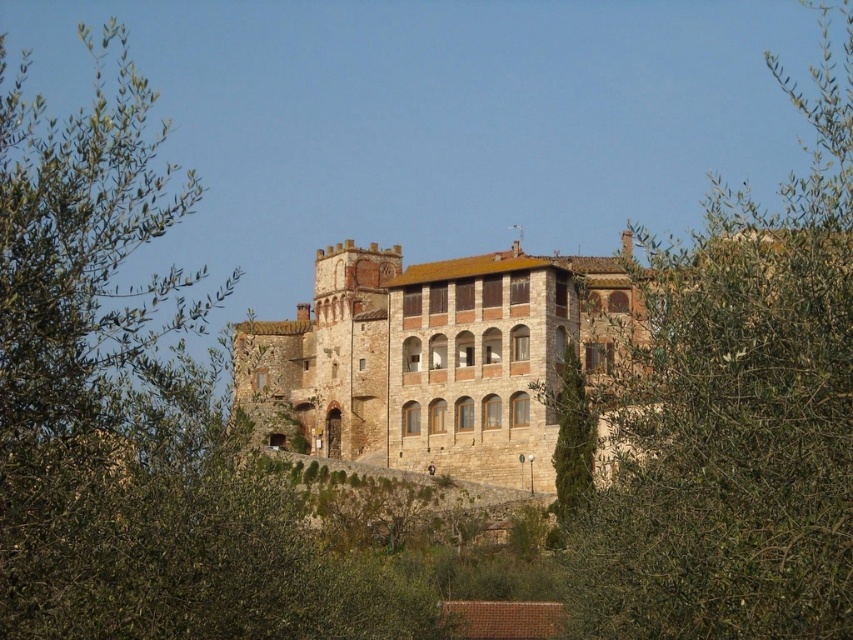
Question: Is the position of green leafy tree at center more distant than that of green textured tree at lower right?

Choices:
 (A) yes
 (B) no

Answer: (B)

Question: Which object appears closest to the camera in this image?

Choices:
 (A) green textured tree at lower right
 (B) brown stone castle at center
 (C) green leafy tree at center

Answer: (C)

Question: Does green leafy tree at upper left have a larger size compared to brown stone castle at center?

Choices:
 (A) no
 (B) yes

Answer: (B)

Question: Which of the following is the farthest from the observer?

Choices:
 (A) (758, 586)
 (B) (161, 490)
 (C) (566, 452)

Answer: (C)

Question: Among these points, which one is nearest to the camera?

Choices:
 (A) (572, 428)
 (B) (640, 547)
 (C) (254, 570)
 (D) (543, 326)

Answer: (C)

Question: From the image, what is the correct spatial relationship of green leafy tree at center in relation to green textured tree at lower right?

Choices:
 (A) left
 (B) right

Answer: (B)